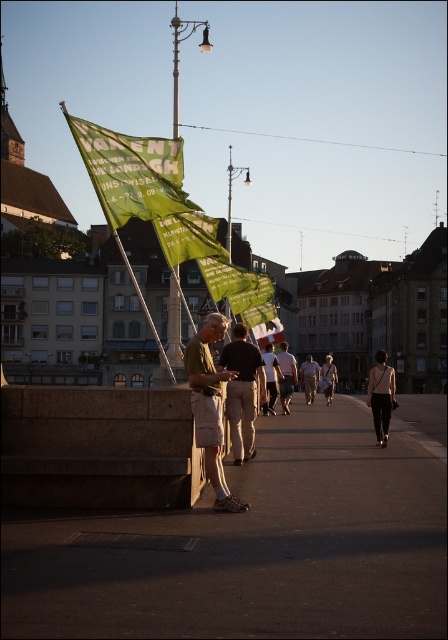
You are a delivery robot on the bridge. You need to deliver a package to the smooth concrete pavement at center. However, there is an obstacle, the khaki cotton shorts at center. Can you navigate around it?

The smooth concrete pavement at center is bigger than khaki cotton shorts at center, so yes, the delivery robot can navigate around the khaki cotton shorts at center to reach the smooth concrete pavement at center.

You are a tourist standing on the bridge and want to take a photo of the green fabric flag at center. The metallic pole at center is blocking your view. Can you move to the left or right to get a clear shot without the pole in the way?

The green fabric flag at center is positioned under the metallic pole at center, so moving to the left or right might allow you to position yourself where the pole no longer blocks the flag.

You are a delivery drone operator. Your drone needs to deliver a package from the smooth concrete pavement at center to the metallic pole at center. The drone can only fly 30 meters before needing to recharge. Can it make the trip without recharging?

The distance between the smooth concrete pavement at center and the metallic pole at center is 32.54 meters. Since the drone can only fly 30 meters before needing to recharge, it cannot make the trip without recharging.